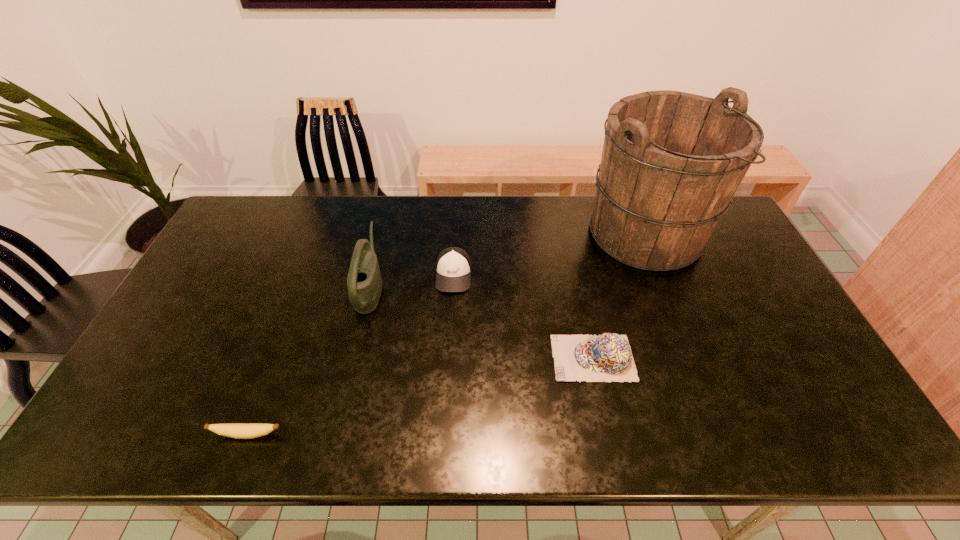
Locate an element on the screen. This screenshot has height=540, width=960. vacant area between the fourth farthest object and the left cap is located at coordinates (523, 316).

At what (x,y) coordinates should I click in order to perform the action: click on free space between the right cap and the shortest object. Please return your answer as a coordinate pair (x, y). Looking at the image, I should click on (x=420, y=396).

The height and width of the screenshot is (540, 960). Identify the location of free space that is in between the tallest object and the fourth shortest object. (508, 261).

The height and width of the screenshot is (540, 960). I want to click on free spot between the tallest object and the left cap, so click(549, 254).

Find the location of `free spot between the banana and the watering can`. free spot between the banana and the watering can is located at coordinates (309, 361).

Identify the location of object that is the second nearest to the left cap. The width and height of the screenshot is (960, 540). (608, 357).

At what (x,y) coordinates should I click in order to perform the action: click on the closest object to the bucket. Please return your answer as a coordinate pair (x, y). Looking at the image, I should click on (608, 357).

Where is `free spot that satisfies the following two spatial constraints: 1. on the front side of the tallest object; 2. on the spout of the fourth object from right to left`? The width and height of the screenshot is (960, 540). free spot that satisfies the following two spatial constraints: 1. on the front side of the tallest object; 2. on the spout of the fourth object from right to left is located at coordinates (666, 287).

Where is `free region that satisfies the following two spatial constraints: 1. on the back side of the nearest object; 2. on the left side of the tallest object`? free region that satisfies the following two spatial constraints: 1. on the back side of the nearest object; 2. on the left side of the tallest object is located at coordinates (324, 234).